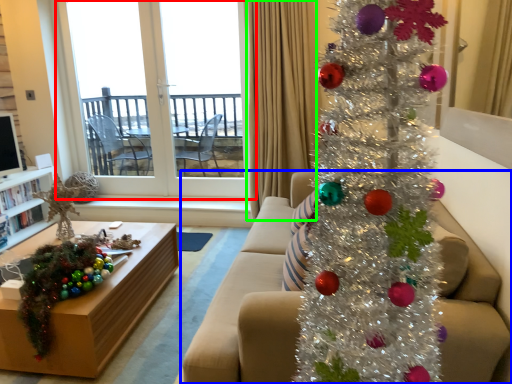
Question: Which object is the farthest from window (highlighted by a red box)? Choose among these: studio couch (highlighted by a blue box) or curtain (highlighted by a green box).

Choices:
 (A) studio couch
 (B) curtain

Answer: (A)